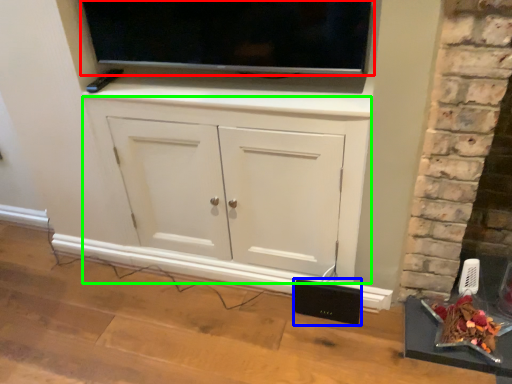
Question: Based on their relative distances, which object is nearer to television (highlighted by a red box)? Choose from speaker (highlighted by a blue box) and cabinetry (highlighted by a green box).

Choices:
 (A) speaker
 (B) cabinetry

Answer: (B)